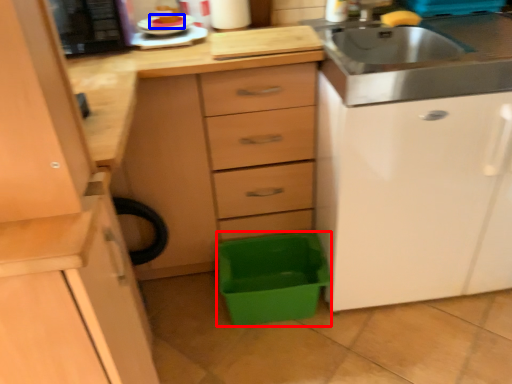
Question: Which point is closer to the camera, storage box (highlighted by a red box) or food (highlighted by a blue box)?

Choices:
 (A) storage box
 (B) food

Answer: (B)